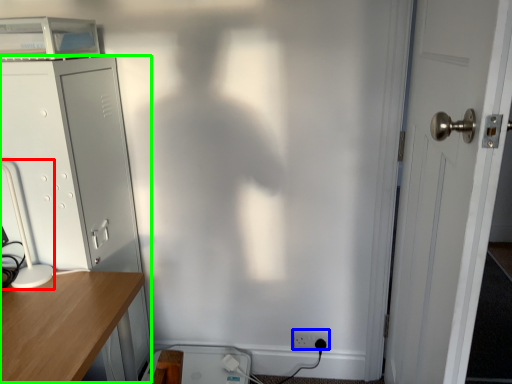
Question: Which object is the closest to the table lamp (highlighted by a red box)? Choose among these: electric outlet (highlighted by a blue box) or file cabinet (highlighted by a green box).

Choices:
 (A) electric outlet
 (B) file cabinet

Answer: (B)